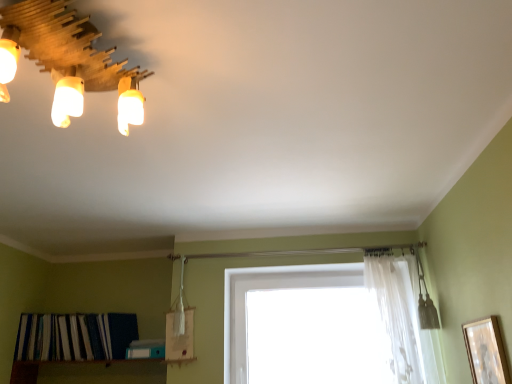
Question: Is transparent glass window at center wider or thinner than wooden light fixture at upper left?

Choices:
 (A) thin
 (B) wide

Answer: (A)

Question: Considering the positions of point (382, 352) and point (123, 119), is point (382, 352) closer or farther from the camera than point (123, 119)?

Choices:
 (A) closer
 (B) farther

Answer: (B)

Question: Considering the real-world distances, which object is farthest from the transparent glass window at center?

Choices:
 (A) striped fabric at lower left
 (B) wooden picture frame at right
 (C) white sheer curtain at upper center
 (D) wooden light fixture at upper left

Answer: (D)

Question: Which is nearer to the transparent glass window at center?

Choices:
 (A) white sheer curtain at upper center
 (B) striped fabric at lower left
 (C) wooden light fixture at upper left
 (D) wooden picture frame at right

Answer: (A)